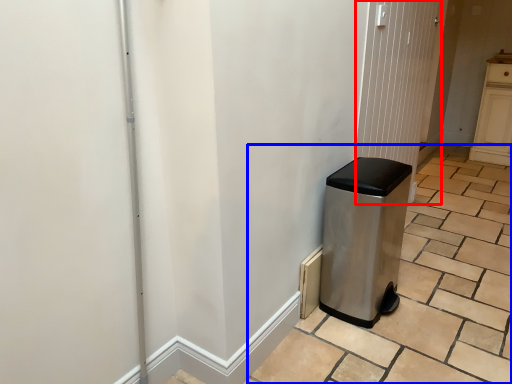
Question: Which point is closer to the camera, screen door (highlighted by a red box) or tile (highlighted by a blue box)?

Choices:
 (A) screen door
 (B) tile

Answer: (B)